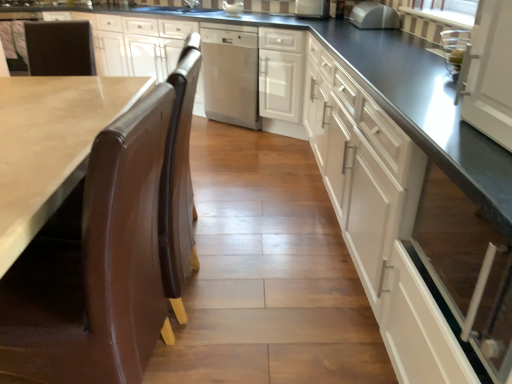
What do you see at coordinates (14, 44) in the screenshot?
I see `brown leather chair at left` at bounding box center [14, 44].

Measure the distance between point (24,63) and camera.

They are 8.39 feet apart.

The height and width of the screenshot is (384, 512). Find the location of `satin white refrigerator at upper center, which is the second appliance from left to right`. satin white refrigerator at upper center, which is the second appliance from left to right is located at coordinates (312, 9).

The height and width of the screenshot is (384, 512). I want to click on white glossy cabinet at center, which ranks as the 2th cabinetry in front-to-back order, so click(x=281, y=81).

You are a GUI agent. You are given a task and a screenshot of the screen. Output one action in this format:
    pyautogui.click(x=<x>, y=<y>)
    Task: Click on the white striped fabric at upper right
    This screenshot has height=384, width=512.
    Given the screenshot: What is the action you would take?
    pyautogui.click(x=437, y=17)

Image resolution: width=512 pixels, height=384 pixels. There is a white glossy cabinet at right, the 2th cabinetry in the back-to-front sequence. What are the coordinates of `cabinetry above it (from a real-world perspective)` in the screenshot? It's located at (281, 81).

Considering the positions of objects white glossy cabinet at center, which is counted as the first cabinetry, starting from the back, and white glossy cabinet at right, the 2th cabinetry in the back-to-front sequence, in the image provided, who is in front, white glossy cabinet at center, which is counted as the first cabinetry, starting from the back, or white glossy cabinet at right, the 2th cabinetry in the back-to-front sequence,?

white glossy cabinet at right, the 2th cabinetry in the back-to-front sequence, is in front.

From the image's perspective, relative to white glossy cabinet at right, the 2th cabinetry in the back-to-front sequence, is white glossy cabinet at center, which ranks as the 2th cabinetry in front-to-back order, above or below?

white glossy cabinet at center, which ranks as the 2th cabinetry in front-to-back order, is situated higher than white glossy cabinet at right, the 2th cabinetry in the back-to-front sequence, in the image.

What's the angular difference between brown polished wood countertop at lower left and white striped fabric at upper right's facing directions?

There is a 0.951-degree angle between the facing directions of brown polished wood countertop at lower left and white striped fabric at upper right.

Is brown polished wood countertop at lower left facing away from white striped fabric at upper right?

Yes, brown polished wood countertop at lower left is facing away from white striped fabric at upper right.

Do you think brown polished wood countertop at lower left is within white striped fabric at upper right, or outside of it?

brown polished wood countertop at lower left is not enclosed by white striped fabric at upper right.

From a real-world perspective, which is physically below, brown polished wood countertop at lower left or white striped fabric at upper right?

brown polished wood countertop at lower left, from a real-world perspective.

Are white glossy gravy boat at center, the third appliance from the right, and brown leather chair at left making contact?

white glossy gravy boat at center, the third appliance from the right, and brown leather chair at left are clearly separated.

Is white glossy gravy boat at center, the 3th appliance viewed from the front, bigger or smaller than brown leather chair at left?

In the image, white glossy gravy boat at center, the 3th appliance viewed from the front, appears to be smaller than brown leather chair at left.

Is white glossy gravy boat at center, the 3th appliance viewed from the front, thinner than brown leather chair at left?

No, white glossy gravy boat at center, the 3th appliance viewed from the front, is not thinner than brown leather chair at left.

From the image's perspective, which appliance is the 1st one below the brown leather chair at left? Please provide its 2D coordinates.

[(233, 8)]

Based on the photo, considering the sizes of white glossy gravy boat at center, positioned as the first appliance in left-to-right order, and white glossy cabinet at right, the 2th cabinetry in the back-to-front sequence, in the image, is white glossy gravy boat at center, positioned as the first appliance in left-to-right order, wider or thinner than white glossy cabinet at right, the 2th cabinetry in the back-to-front sequence,?

Clearly, white glossy gravy boat at center, positioned as the first appliance in left-to-right order, has less width compared to white glossy cabinet at right, the 2th cabinetry in the back-to-front sequence.

Identify the location of the 2nd cabinetry in front of the white glossy gravy boat at center, the 3th appliance viewed from the front, counting from the anchor's position. The width and height of the screenshot is (512, 384). (399, 225).

Choose the correct answer: Is white glossy gravy boat at center, positioned as the first appliance in left-to-right order, inside white glossy cabinet at right, the 2th cabinetry in the back-to-front sequence, or outside it?

white glossy gravy boat at center, positioned as the first appliance in left-to-right order, cannot be found inside white glossy cabinet at right, the 2th cabinetry in the back-to-front sequence.

Is white glossy gravy boat at center, positioned as the first appliance in left-to-right order, facing away from white glossy cabinet at right, the 2th cabinetry in the back-to-front sequence?

No.

Can we say stainless steel dishwasher at center lies outside white striped fabric at upper right?

Yes, stainless steel dishwasher at center is not within white striped fabric at upper right.

Is stainless steel dishwasher at center taller than white striped fabric at upper right?

Indeed, stainless steel dishwasher at center has a greater height compared to white striped fabric at upper right.

Based on the photo, are stainless steel dishwasher at center and white striped fabric at upper right making contact?

They are not placed beside each other.

Which is more distant, (230, 35) or (403, 25)?

Positioned behind is point (230, 35).

Is white glossy gravy boat at center, positioned as the first appliance in left-to-right order, positioned far away from brown polished wood countertop at lower left?

white glossy gravy boat at center, positioned as the first appliance in left-to-right order, is positioned a significant distance from brown polished wood countertop at lower left.

Is point (237, 12) more distant than point (53, 160)?

Yes, it is behind point (53, 160).

Is white glossy gravy boat at center, which appears as the first appliance when viewed from the back, facing towards brown polished wood countertop at lower left?

Yes, white glossy gravy boat at center, which appears as the first appliance when viewed from the back, is oriented towards brown polished wood countertop at lower left.

Is white glossy gravy boat at center, the third appliance from the right, closer to camera compared to brown polished wood countertop at lower left?

No, white glossy gravy boat at center, the third appliance from the right, is further to the viewer.

You are a GUI agent. You are given a task and a screenshot of the screen. Output one action in this format:
    pyautogui.click(x=<x>, y=<y>)
    Task: Click on the appliance that is the 3rd object located above the white glossy cabinet at right, which appears as the first cabinetry when viewed from the front (from the image's perspective)
    
    Given the screenshot: What is the action you would take?
    pyautogui.click(x=233, y=8)

Based on the photo, considering the sizes of white glossy cabinet at right, the 2th cabinetry in the back-to-front sequence, and white glossy gravy boat at center, positioned as the first appliance in left-to-right order, in the image, is white glossy cabinet at right, the 2th cabinetry in the back-to-front sequence, taller or shorter than white glossy gravy boat at center, positioned as the first appliance in left-to-right order,?

Considering their sizes, white glossy cabinet at right, the 2th cabinetry in the back-to-front sequence, has more height than white glossy gravy boat at center, positioned as the first appliance in left-to-right order.

Can white glossy gravy boat at center, which appears as the first appliance when viewed from the back, be found inside white glossy cabinet at right, which appears as the first cabinetry when viewed from the front?

No, white glossy gravy boat at center, which appears as the first appliance when viewed from the back, is located outside of white glossy cabinet at right, which appears as the first cabinetry when viewed from the front.

Measure the distance from white glossy cabinet at right, which appears as the first cabinetry when viewed from the front, to white glossy gravy boat at center, the third appliance from the right.

The distance of white glossy cabinet at right, which appears as the first cabinetry when viewed from the front, from white glossy gravy boat at center, the third appliance from the right, is 7.53 feet.

Identify the location of cabinetry that is on the right side of white glossy cabinet at center, which ranks as the 2th cabinetry in front-to-back order. (399, 225).

This screenshot has width=512, height=384. I want to click on countertop in front of the white striped fabric at upper right, so click(50, 145).

Based on their spatial positions, is white glossy gravy boat at center, positioned as the first appliance in left-to-right order, or brown leather chair at left closer to white striped fabric at upper right?

Based on the image, white glossy gravy boat at center, positioned as the first appliance in left-to-right order, appears to be nearer to white striped fabric at upper right.

Estimate the real-world distances between objects in this image. Which object is closer to satin silver microwave at upper center, the 1th appliance from the front, stainless steel dishwasher at center or white glossy cabinet at center, which is counted as the first cabinetry, starting from the back?

white glossy cabinet at center, which is counted as the first cabinetry, starting from the back, lies closer to satin silver microwave at upper center, the 1th appliance from the front, than the other object.

Which object lies further to the anchor point brown leather chair at left, white striped fabric at upper right or brown polished wood countertop at lower left?

white striped fabric at upper right is positioned further to the anchor brown leather chair at left.

When comparing their distances from brown leather chair at left, does white glossy cabinet at center, which ranks as the 2th cabinetry in front-to-back order, or brown polished wood countertop at lower left seem further?

white glossy cabinet at center, which ranks as the 2th cabinetry in front-to-back order, is positioned further to the anchor brown leather chair at left.

From the image, which object appears to be farther from satin white refrigerator at upper center, which is the second appliance from left to right, white striped fabric at upper right or brown polished wood countertop at lower left?

brown polished wood countertop at lower left is further to satin white refrigerator at upper center, which is the second appliance from left to right.

When comparing their distances from white glossy cabinet at center, which is counted as the first cabinetry, starting from the back, does white glossy cabinet at right, the 2th cabinetry in the back-to-front sequence, or satin white refrigerator at upper center, the second appliance viewed from the front, seem closer?

satin white refrigerator at upper center, the second appliance viewed from the front.

From the image, which object appears to be farther from white striped fabric at upper right, satin silver microwave at upper center, the first appliance viewed from the right, or white glossy gravy boat at center, which appears as the first appliance when viewed from the back?

The object further to white striped fabric at upper right is white glossy gravy boat at center, which appears as the first appliance when viewed from the back.

Estimate the real-world distances between objects in this image. Which object is further from white striped fabric at upper right, brown polished wood countertop at lower left or satin white refrigerator at upper center, which is the second appliance from left to right?

brown polished wood countertop at lower left is further to white striped fabric at upper right.

Where is `window screen between brown polished wood countertop at lower left and brown leather chair at left in the front-back direction`? window screen between brown polished wood countertop at lower left and brown leather chair at left in the front-back direction is located at coordinates (437, 17).

Find the location of a particular element. window screen between white glossy cabinet at right, which appears as the first cabinetry when viewed from the front, and satin silver microwave at upper center, the first appliance viewed from the right, along the z-axis is located at coordinates (437, 17).

What are the coordinates of `appliance between brown leather chair at left and stainless steel dishwasher at center` in the screenshot? It's located at (233, 8).

Image resolution: width=512 pixels, height=384 pixels. I want to click on appliance between satin white refrigerator at upper center, which is the second appliance in back-to-front order, and white glossy cabinet at center, which is counted as the first cabinetry, starting from the back, from top to bottom, so click(374, 16).